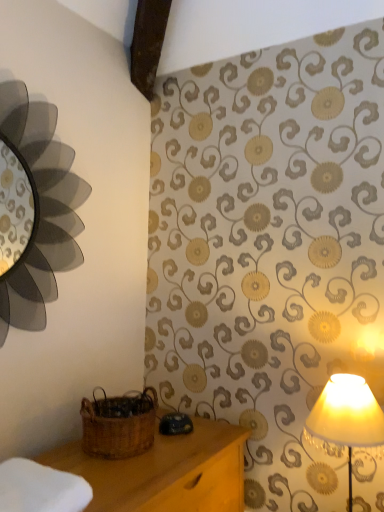
Question: From a real-world perspective, does matte cream lampshade at right stand above woven brown basket at lower left?

Choices:
 (A) yes
 (B) no

Answer: (B)

Question: Can you confirm if matte cream lampshade at right is taller than woven brown basket at lower left?

Choices:
 (A) yes
 (B) no

Answer: (A)

Question: Can you confirm if matte cream lampshade at right is smaller than woven brown basket at lower left?

Choices:
 (A) yes
 (B) no

Answer: (B)

Question: Can you confirm if matte cream lampshade at right is positioned to the left of woven brown basket at lower left?

Choices:
 (A) yes
 (B) no

Answer: (B)

Question: Is matte cream lampshade at right oriented away from woven brown basket at lower left?

Choices:
 (A) no
 (B) yes

Answer: (A)

Question: In terms of width, does matte cream lampshade at right look wider or thinner when compared to woven brown basket at lower left?

Choices:
 (A) wide
 (B) thin

Answer: (B)

Question: In terms of height, does matte cream lampshade at right look taller or shorter compared to woven brown basket at lower left?

Choices:
 (A) short
 (B) tall

Answer: (B)

Question: Relative to woven brown basket at lower left, is matte cream lampshade at right in front or behind?

Choices:
 (A) front
 (B) behind

Answer: (A)

Question: Is matte cream lampshade at right bigger or smaller than woven brown basket at lower left?

Choices:
 (A) small
 (B) big

Answer: (B)

Question: Is white soft cloth at lower left bigger or smaller than matte cream lampshade at right?

Choices:
 (A) small
 (B) big

Answer: (A)

Question: From the image's perspective, is white soft cloth at lower left positioned above or below matte cream lampshade at right?

Choices:
 (A) below
 (B) above

Answer: (B)

Question: Choose the correct answer: Is white soft cloth at lower left inside matte cream lampshade at right or outside it?

Choices:
 (A) inside
 (B) outside

Answer: (B)

Question: Considering the positions of point (28, 471) and point (311, 416), is point (28, 471) closer or farther from the camera than point (311, 416)?

Choices:
 (A) closer
 (B) farther

Answer: (A)

Question: Based on their positions, is white soft cloth at lower left located to the left or right of woven brown basket at lower left?

Choices:
 (A) right
 (B) left

Answer: (B)

Question: Does point (33, 504) appear closer or farther from the camera than point (155, 394)?

Choices:
 (A) farther
 (B) closer

Answer: (B)